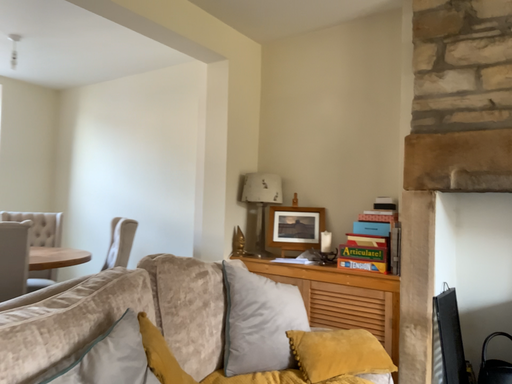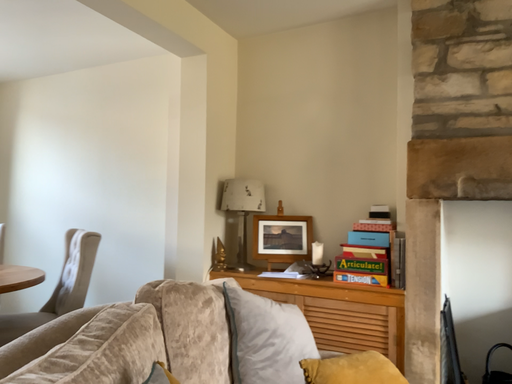
Question: Which way did the camera rotate in the video?

Choices:
 (A) rotated right
 (B) rotated left

Answer: (A)